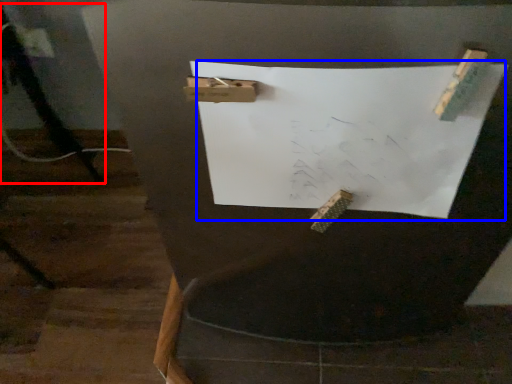
Question: Among these objects, which one is farthest to the camera, tripod (highlighted by a red box) or paper (highlighted by a blue box)?

Choices:
 (A) tripod
 (B) paper

Answer: (A)